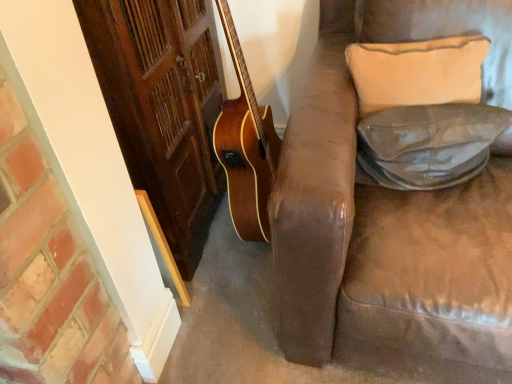
Question: Is beige fabric pillow at upper right, the second pillow when ordered from bottom to top, to the left of leather at right, positioned as the 1th pillow in bottom-to-top order, from the viewer's perspective?

Choices:
 (A) yes
 (B) no

Answer: (A)

Question: Is beige fabric pillow at upper right, the second pillow when ordered from bottom to top, taller than leather at right, positioned as the 1th pillow in bottom-to-top order?

Choices:
 (A) yes
 (B) no

Answer: (A)

Question: Is beige fabric pillow at upper right, positioned as the first pillow in top-to-bottom order, not within leather at right, which ranks as the second pillow in top-to-bottom order?

Choices:
 (A) no
 (B) yes

Answer: (B)

Question: Is beige fabric pillow at upper right, the second pillow when ordered from bottom to top, smaller than leather at right, positioned as the 1th pillow in bottom-to-top order?

Choices:
 (A) yes
 (B) no

Answer: (B)

Question: Considering the relative sizes of beige fabric pillow at upper right, the second pillow when ordered from bottom to top, and leather at right, which ranks as the second pillow in top-to-bottom order, in the image provided, is beige fabric pillow at upper right, the second pillow when ordered from bottom to top, shorter than leather at right, which ranks as the second pillow in top-to-bottom order,?

Choices:
 (A) no
 (B) yes

Answer: (A)

Question: Is beige fabric pillow at upper right, the second pillow when ordered from bottom to top, turned away from leather at right, positioned as the 1th pillow in bottom-to-top order?

Choices:
 (A) yes
 (B) no

Answer: (B)

Question: From a real-world perspective, does leather at right, positioned as the 1th pillow in bottom-to-top order, sit lower than beige fabric pillow at upper right, positioned as the first pillow in top-to-bottom order?

Choices:
 (A) yes
 (B) no

Answer: (A)

Question: Is leather at right, positioned as the 1th pillow in bottom-to-top order, completely or partially outside of beige fabric pillow at upper right, the second pillow when ordered from bottom to top?

Choices:
 (A) no
 (B) yes

Answer: (B)

Question: Is leather at right, positioned as the 1th pillow in bottom-to-top order, closer to camera compared to beige fabric pillow at upper right, positioned as the first pillow in top-to-bottom order?

Choices:
 (A) yes
 (B) no

Answer: (A)

Question: Can you see leather at right, which ranks as the second pillow in top-to-bottom order, touching beige fabric pillow at upper right, positioned as the first pillow in top-to-bottom order?

Choices:
 (A) yes
 (B) no

Answer: (A)

Question: Can you confirm if leather at right, positioned as the 1th pillow in bottom-to-top order, is smaller than beige fabric pillow at upper right, positioned as the first pillow in top-to-bottom order?

Choices:
 (A) no
 (B) yes

Answer: (B)

Question: Does leather at right, which ranks as the second pillow in top-to-bottom order, have a larger size compared to beige fabric pillow at upper right, positioned as the first pillow in top-to-bottom order?

Choices:
 (A) yes
 (B) no

Answer: (B)

Question: Considering the positions of point (471, 67) and point (396, 112), is point (471, 67) closer or farther from the camera than point (396, 112)?

Choices:
 (A) closer
 (B) farther

Answer: (A)